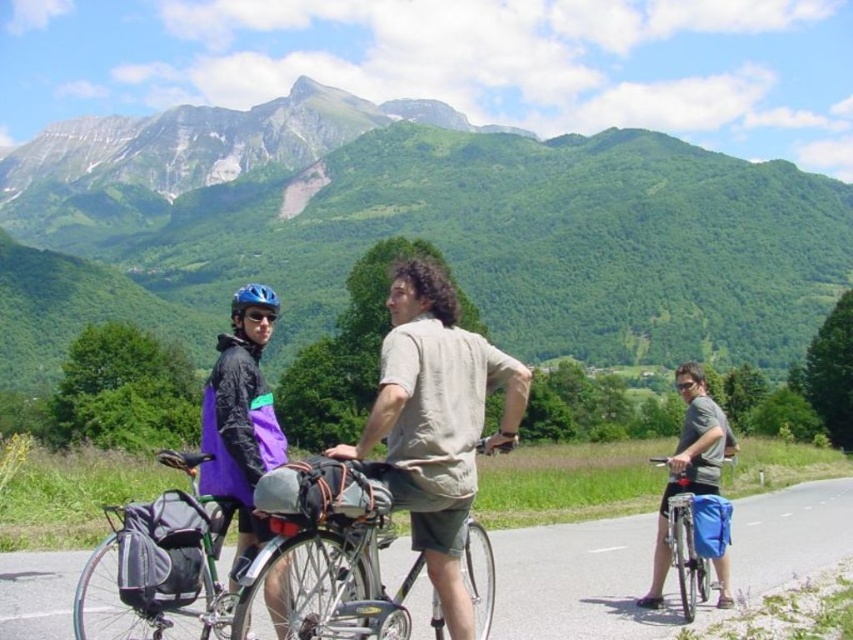
You are a hiker planning to take a photo of the green grassy mountain at upper center and the blue fabric bag at right. To capture both in the same frame, should you adjust your camera to a wider or narrower angle?

Since the green grassy mountain at upper center is to the left of the blue fabric bag at right, you should adjust your camera to a wider angle to include both objects in the same frame.

You are a photographer standing in the scene and want to take a photo of the silver metallic bicycle at center without the matte black jacket at left blocking it. What should you do?

The matte black jacket at left is positioned over the silver metallic bicycle at center, so to avoid it blocking the view, you should move to the right side of the bicycle.

You are a drone operator trying to capture a photo of the green grassy mountain at upper center. The camera is currently focused on the point at coordinates point (450, 221). Is the camera pointed at the correct location?

Yes, the camera is pointed at the correct location because the point (450, 221) corresponds to the green grassy mountain at upper center.